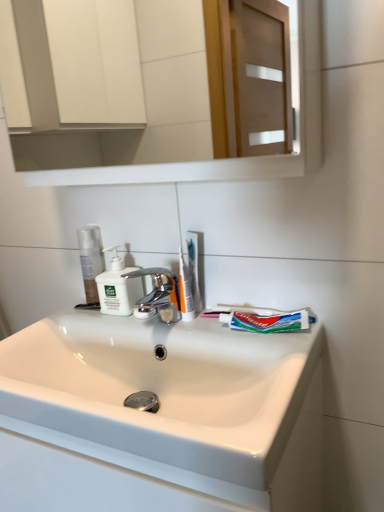
Locate an element on the screen. free space to the left of green matte toothpaste at center is located at coordinates (197, 332).